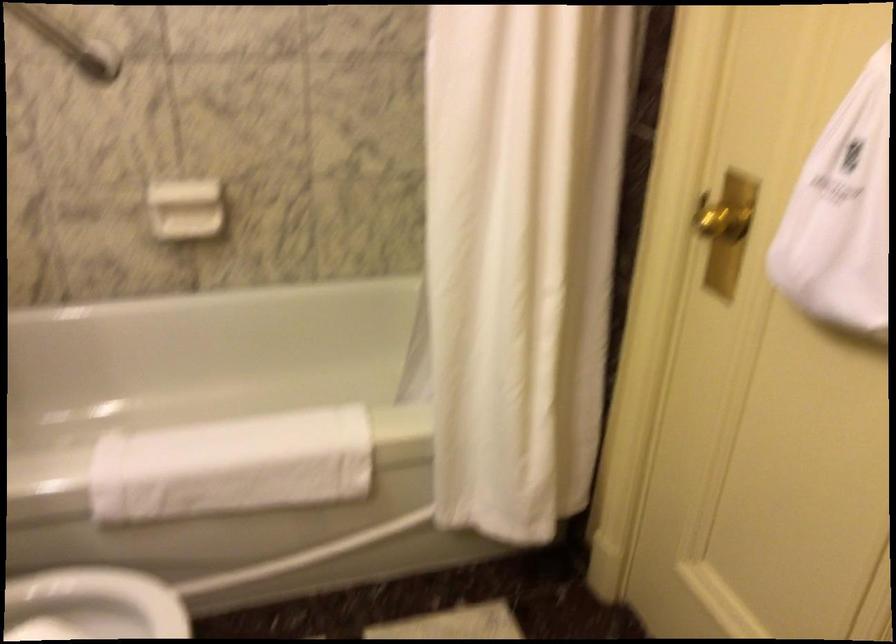
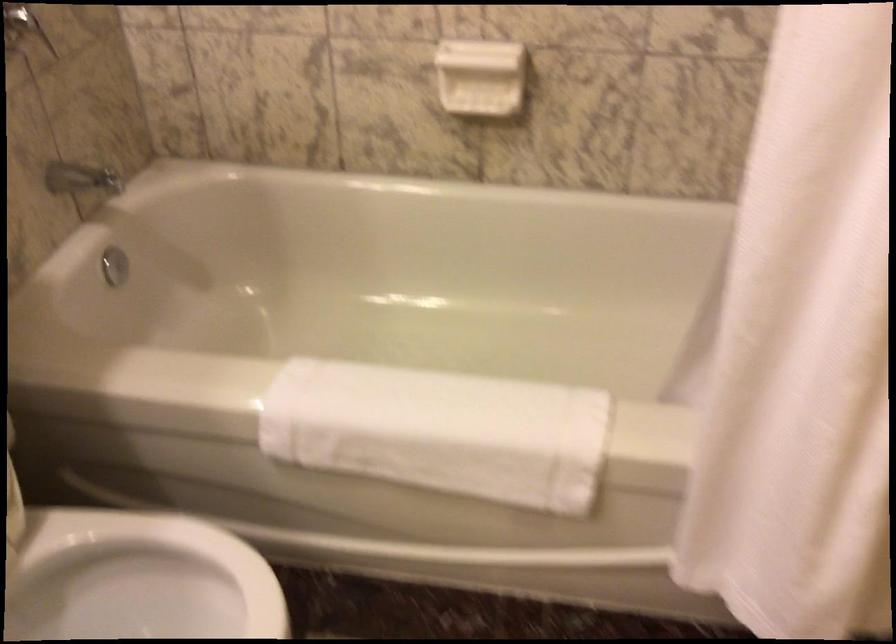
Locate, in the second image, the point that corresponds to the point at 250,460 in the first image.

(440, 431)